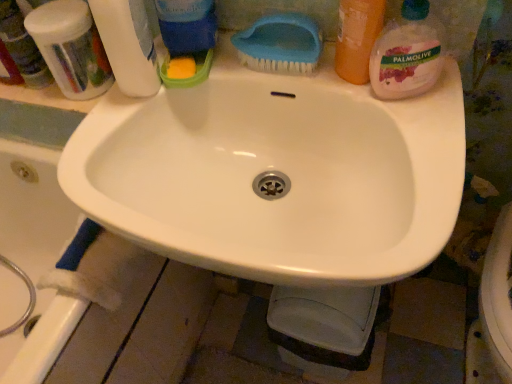
Question: Relative to blue plastic brush at upper center, is translucent orange soap at upper right, placed as the second cleaning product when sorted from right to left, in front or behind?

Choices:
 (A) behind
 (B) front

Answer: (B)

Question: In terms of width, does translucent orange soap at upper right, placed as the second cleaning product when sorted from right to left, look wider or thinner when compared to blue plastic brush at upper center?

Choices:
 (A) thin
 (B) wide

Answer: (A)

Question: Which of these objects is positioned farthest from the blue plastic brush at upper center?

Choices:
 (A) palmolive liquid soap at upper right, which appears as the first cleaning product when viewed from the right
 (B) translucent orange soap at upper right, which ranks as the 3th cleaning product in left-to-right order
 (C) blue matte sponge at upper left, the second cleaning product viewed from the left
 (D) translucent plastic toothbrushes at upper left
 (E) white plastic bottle at upper left, the 1th cleaning product from the left

Answer: (D)

Question: Considering the real-world distances, which object is closest to the palmolive liquid soap at upper right, the fourth cleaning product viewed from the left?

Choices:
 (A) blue matte sponge at upper left, which is the third cleaning product in right-to-left order
 (B) translucent plastic toothbrushes at upper left
 (C) translucent orange soap at upper right, placed as the second cleaning product when sorted from right to left
 (D) white glossy sink at center
 (E) white plastic bottle at upper left, the 1th cleaning product from the left

Answer: (C)